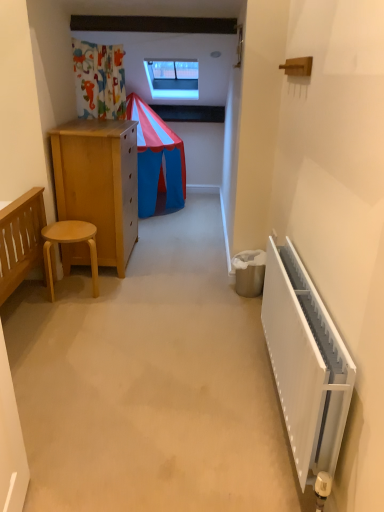
Question: Is transparent glass window at upper center taller or shorter than light wood stool at left?

Choices:
 (A) short
 (B) tall

Answer: (B)

Question: Is point (157, 74) closer or farther from the camera than point (57, 226)?

Choices:
 (A) farther
 (B) closer

Answer: (A)

Question: Considering the real-world distances, which object is farthest from the white plastic radiator at right?

Choices:
 (A) transparent glass window at upper center
 (B) light wood stool at left

Answer: (A)

Question: Which object is the closest to the light wood stool at left?

Choices:
 (A) transparent glass window at upper center
 (B) white plastic radiator at right

Answer: (B)